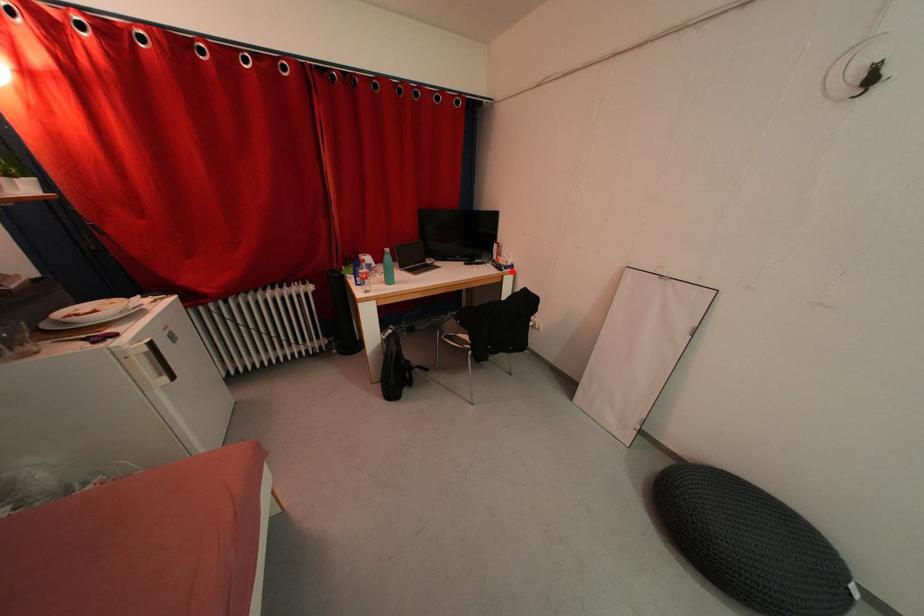
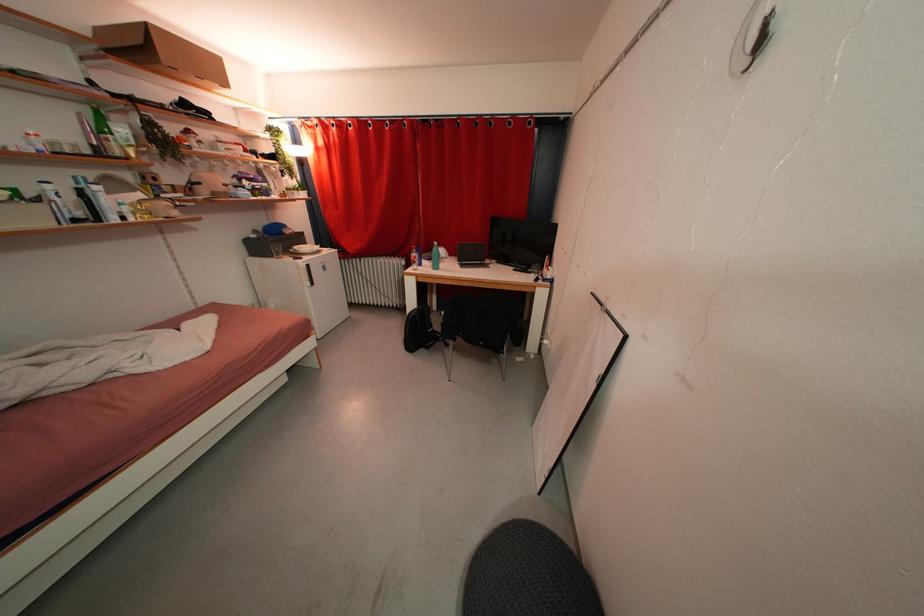
Where in the second image is the point corresponding to the highlighted location from the first image?

(551, 284)